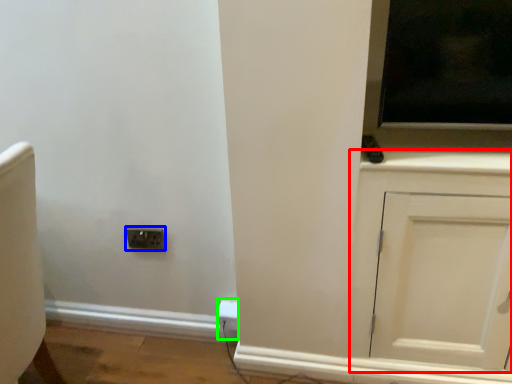
Question: Estimate the real-world distances between objects in this image. Which object is closer to cabinetry (highlighted by a red box), socket (highlighted by a blue box) or electric outlet (highlighted by a green box)?

Choices:
 (A) socket
 (B) electric outlet

Answer: (B)